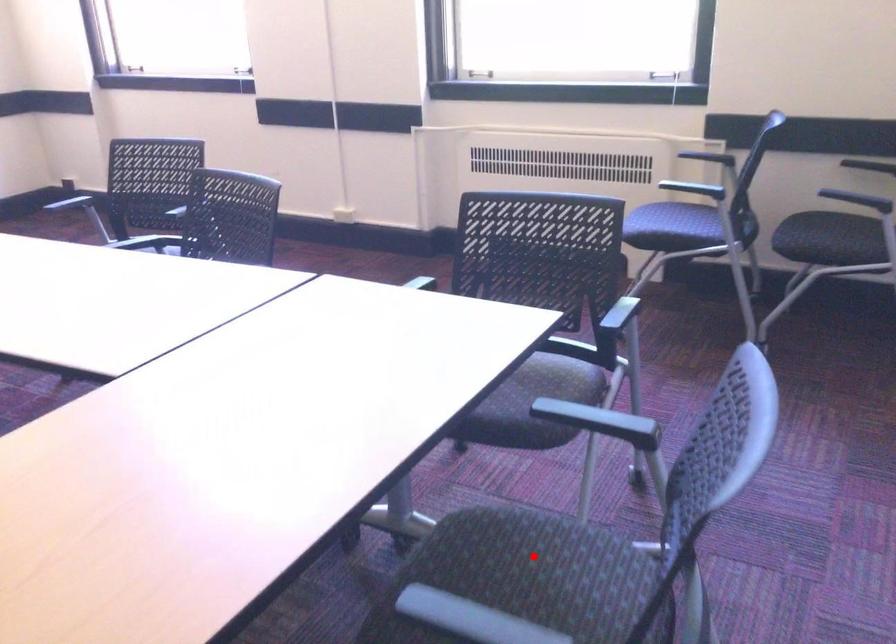
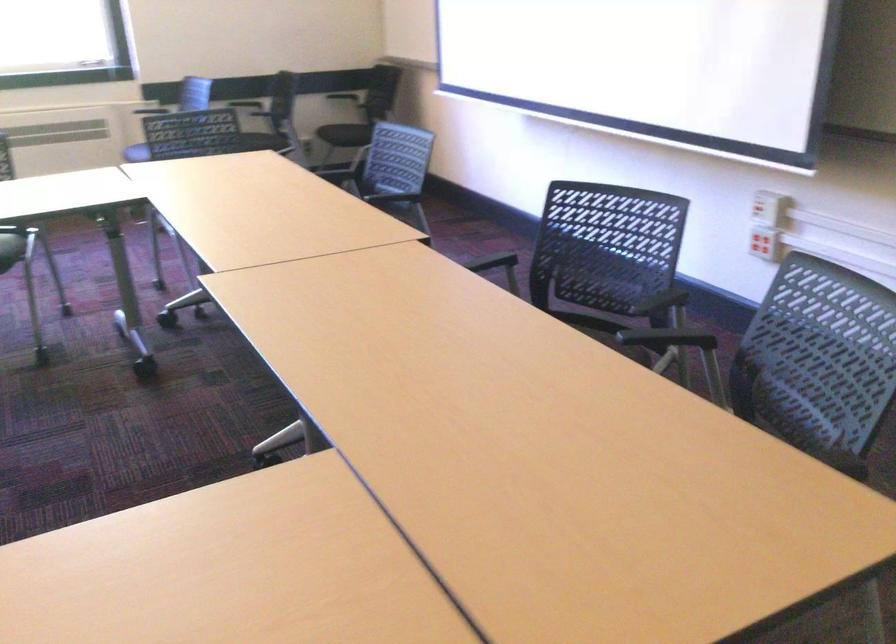
Question: I am providing you with two images of the same scene from different viewpoints. A red point is marked on the first image. At the location where the point appears in image 1, is it still visible in image 2?

Choices:
 (A) Yes
 (B) No

Answer: (B)